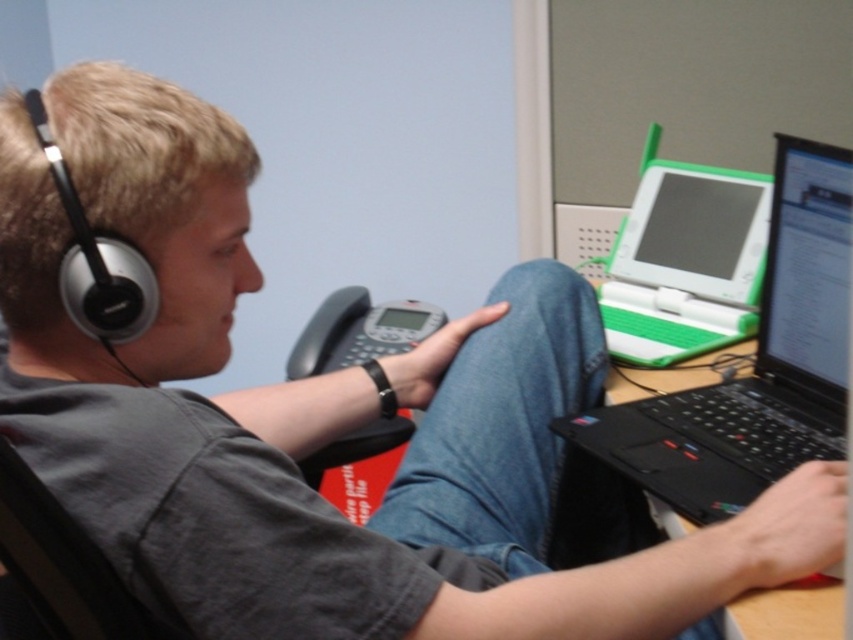
You are organizing a desk and need to place the black plastic laptop at right and the black plastic laptop at lower right. Based on their sizes, which one should you place first to ensure both fit properly?

The black plastic laptop at right might be wider than black plastic laptop at lower right, so you should place the wider one first to ensure both fit properly.

You are an office worker who needs to place a new document on the desk. The document must be placed exactly at point (755, 364). However, there are existing items on the desk. Can you place the document at that point without overlapping any existing items?

The point (755, 364) is on the black plastic laptop at right, so placing the document there would overlap with the laptop. Choose another location.

From the picture: You are organizing a desk and need to place the black matte earphone at left and the black plastic laptop at lower right. Given their sizes, which object should you place first to ensure both fit on the desk?

The black matte earphone at left should be placed first since it occupies less space than the black plastic laptop at lower right, allowing both items to fit properly on the desk.